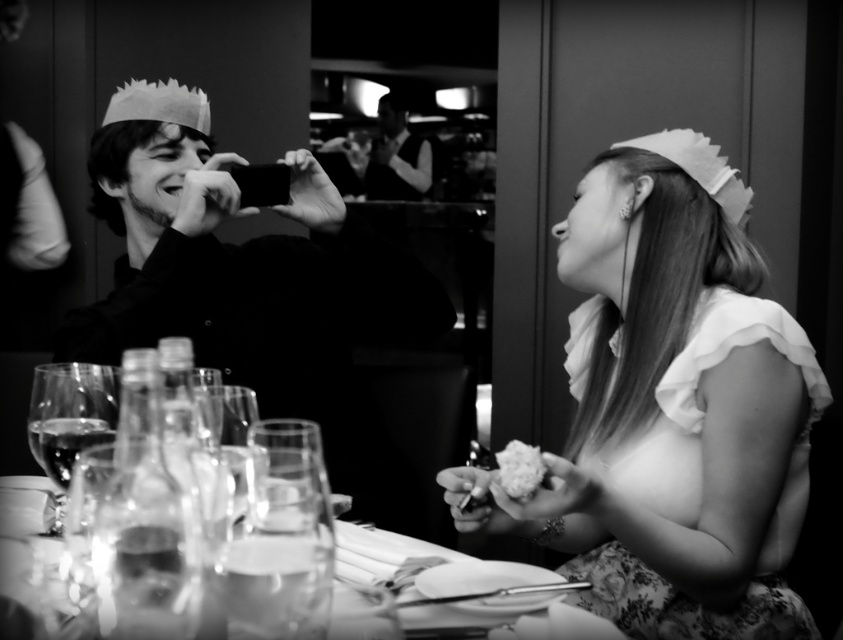
What do you see at coordinates (70, 413) in the screenshot? I see `clear glass wine glass at lower left` at bounding box center [70, 413].

This screenshot has height=640, width=843. Identify the location of clear glass wine glass at lower left. (x=70, y=413).

Identify the location of clear glass wine glass at lower left. (70, 413).

Does white satin dress at right appear on the left side of smooth black shirt at center?

No, white satin dress at right is not to the left of smooth black shirt at center.

Between white satin dress at right and smooth black shirt at center, which one appears on the left side from the viewer's perspective?

smooth black shirt at center is more to the left.

Who is more distant from viewer, (621, 493) or (380, 97)?

Point (380, 97)

At what (x,y) coordinates should I click in order to perform the action: click on white satin dress at right. Please return your answer as a coordinate pair (x, y). Looking at the image, I should click on (670, 406).

Describe the element at coordinates (670, 406) in the screenshot. I see `white satin dress at right` at that location.

Does white satin dress at right have a larger size compared to clear glassware at center?

Yes, white satin dress at right is bigger than clear glassware at center.

Is point (744, 572) closer to camera compared to point (4, 609)?

No.

Locate an element on the screen. white satin dress at right is located at coordinates (670, 406).